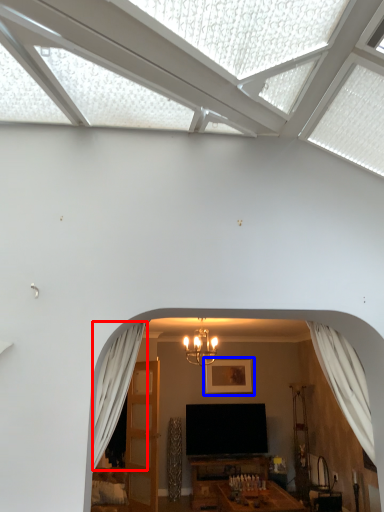
Question: Which object is further to the camera taking this photo, curtain (highlighted by a red box) or picture frame (highlighted by a blue box)?

Choices:
 (A) curtain
 (B) picture frame

Answer: (B)